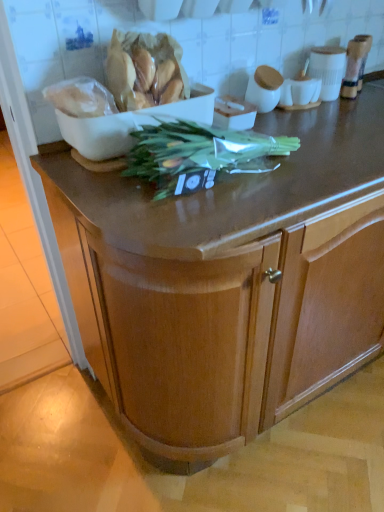
Question: Is wooden cabinet at center in contact with white matte bowl at upper left?

Choices:
 (A) no
 (B) yes

Answer: (A)

Question: From the image's perspective, does wooden cabinet at center appear lower than white matte bowl at upper left?

Choices:
 (A) no
 (B) yes

Answer: (B)

Question: Can you confirm if wooden cabinet at center is shorter than white matte bowl at upper left?

Choices:
 (A) no
 (B) yes

Answer: (A)

Question: Does wooden cabinet at center turn towards white matte bowl at upper left?

Choices:
 (A) no
 (B) yes

Answer: (A)

Question: Is wooden cabinet at center behind white matte bowl at upper left?

Choices:
 (A) no
 (B) yes

Answer: (A)

Question: Is translucent plastic bag of bread at upper left, the 1th food when ordered from right to left, inside the boundaries of white matte bowl at upper left, or outside?

Choices:
 (A) inside
 (B) outside

Answer: (A)

Question: Considering the positions of point (173, 95) and point (114, 123), is point (173, 95) closer or farther from the camera than point (114, 123)?

Choices:
 (A) closer
 (B) farther

Answer: (B)

Question: Looking at their shapes, would you say translucent plastic bag of bread at upper left, the 2th food from the left, is wider or thinner than white matte bowl at upper left?

Choices:
 (A) wide
 (B) thin

Answer: (B)

Question: Is translucent plastic bag of bread at upper left, the 1th food when ordered from right to left, bigger or smaller than white matte bowl at upper left?

Choices:
 (A) small
 (B) big

Answer: (A)

Question: From their relative heights in the image, would you say white matte bowl at upper left is taller or shorter than translucent plastic bag of bread at upper left, the 2th food from the left?

Choices:
 (A) tall
 (B) short

Answer: (B)

Question: In the image, is white matte bowl at upper left positioned in front of or behind translucent plastic bag of bread at upper left, the 2th food from the left?

Choices:
 (A) behind
 (B) front

Answer: (A)

Question: Considering the positions of point (129, 117) and point (152, 88), is point (129, 117) closer or farther from the camera than point (152, 88)?

Choices:
 (A) farther
 (B) closer

Answer: (B)

Question: Looking at the image, does white matte bowl at upper left seem bigger or smaller compared to translucent plastic bag of bread at upper left, the 1th food when ordered from right to left?

Choices:
 (A) big
 (B) small

Answer: (A)

Question: Is white glossy cup at upper right wider or thinner than translucent plastic bag of bread at upper left, the 1th food when ordered from right to left?

Choices:
 (A) wide
 (B) thin

Answer: (B)

Question: Which is correct: white glossy cup at upper right is inside translucent plastic bag of bread at upper left, the 1th food when ordered from right to left, or outside of it?

Choices:
 (A) inside
 (B) outside

Answer: (B)